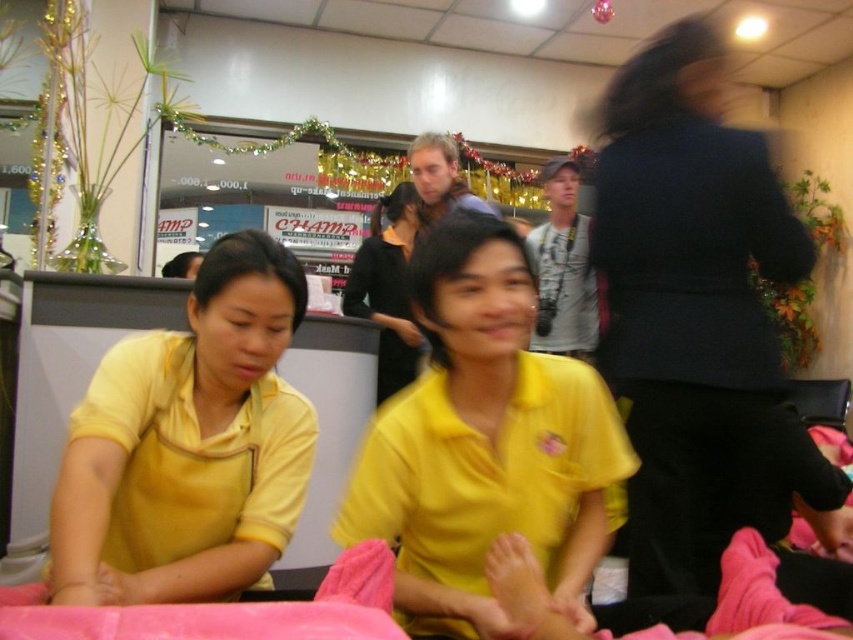
You are a customer entering the massage parlor and see the yellow matte shirt at left and the matte black shirt at center. The massage table between them is 1.2 meters wide. Can both of them stand side by side on the table without overlapping?

The yellow matte shirt at left might be wider than matte black shirt at center. If the yellow matte shirt at left is wider, then the combined width of both could exceed the table width of 1.2 meters. Therefore, it depends on their exact widths, but there is a possibility they cannot stand side by side without overlapping.

You are a customer at the spa and want to choose between two massage tables labeled as point 1 at position point (451, 506) and point 2 at position point (386, 356). Which table is closer to you?

Point 1 at position point (451, 506) is closer to you than point 2 at position point (386, 356).

You are a customer in the spa and want to choose the massage therapist who is wearing the larger yellow matte shirt. Which one should you choose between the yellow matte shirt at center and the yellow matte shirt at left?

The yellow matte shirt at center is bigger than the yellow matte shirt at left, so you should choose the massage therapist wearing the yellow matte shirt at center.